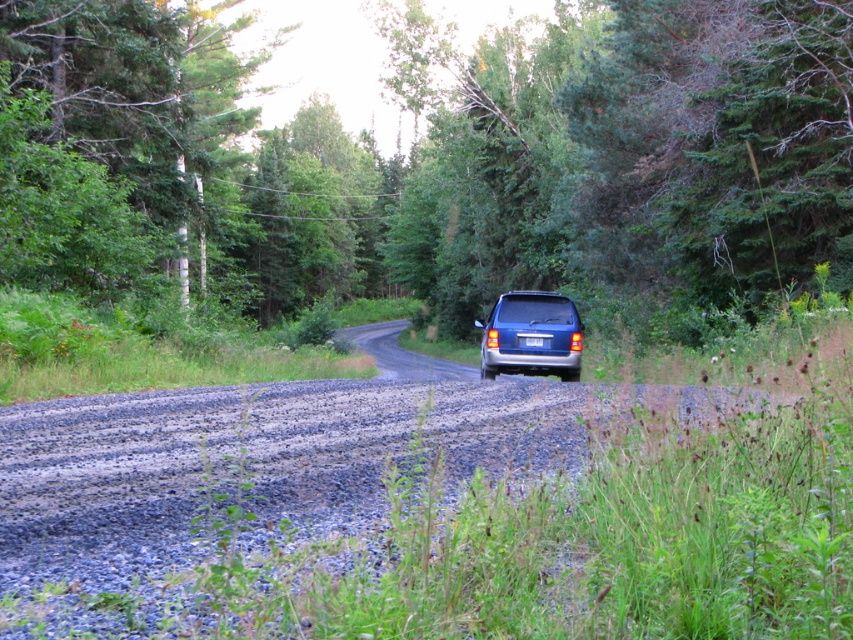
At what (x,y) coordinates should I click in order to perform the action: click on gray gravel road at center. Please return your answer as a coordinate pair (x, y). Looking at the image, I should click on (242, 456).

Can you confirm if gray gravel road at center is smaller than blue metallic license plate at center?

Incorrect, gray gravel road at center is not smaller in size than blue metallic license plate at center.

You are a GUI agent. You are given a task and a screenshot of the screen. Output one action in this format:
    pyautogui.click(x=<x>, y=<y>)
    Task: Click on the gray gravel road at center
    
    Given the screenshot: What is the action you would take?
    pyautogui.click(x=242, y=456)

Does green leafy tree at center have a lesser width compared to gray gravel road at center?

No.

Does green leafy tree at center appear on the right side of gray gravel road at center?

Incorrect, green leafy tree at center is not on the right side of gray gravel road at center.

Between point (267, 304) and point (202, 420), which one is positioned in front?

Point (202, 420) is in front.

You are a GUI agent. You are given a task and a screenshot of the screen. Output one action in this format:
    pyautogui.click(x=<x>, y=<y>)
    Task: Click on the green leafy tree at center
    The width and height of the screenshot is (853, 640).
    Given the screenshot: What is the action you would take?
    pyautogui.click(x=463, y=152)

Is satin blue suv at center to the right of blue metallic license plate at center from the viewer's perspective?

Indeed, satin blue suv at center is positioned on the right side of blue metallic license plate at center.

Between satin blue suv at center and blue metallic license plate at center, which one is positioned higher?

blue metallic license plate at center

Between point (573, 333) and point (541, 342), which one is positioned behind?

The point (541, 342) is behind.

Find the location of a particular element. Image resolution: width=853 pixels, height=640 pixels. satin blue suv at center is located at coordinates (531, 336).